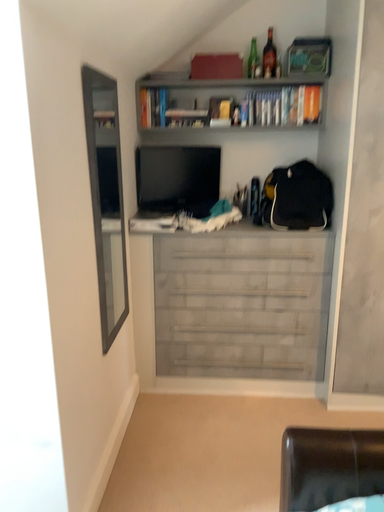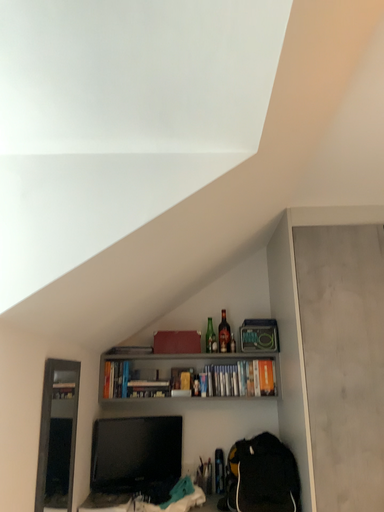
Question: How did the camera likely rotate when shooting the video?

Choices:
 (A) rotated upward
 (B) rotated downward

Answer: (A)